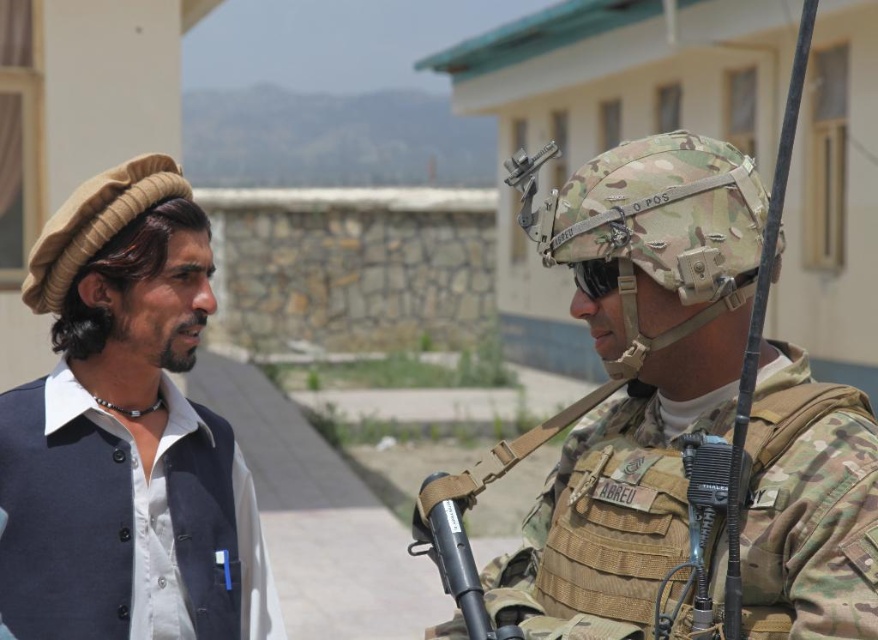
Question: Can you confirm if camouflage fabric helmet at center is positioned to the left of dark blue fabric shirt at left?

Choices:
 (A) no
 (B) yes

Answer: (A)

Question: Is camouflage fabric helmet at center further to camera compared to dark blue fabric shirt at left?

Choices:
 (A) yes
 (B) no

Answer: (B)

Question: Which point is closer to the camera taking this photo?

Choices:
 (A) (657, 148)
 (B) (246, 525)

Answer: (A)

Question: Which point appears farthest from the camera in this image?

Choices:
 (A) 193,353
 (B) 876,506

Answer: (A)

Question: Can you confirm if camouflage fabric helmet at center is positioned to the right of dark blue fabric shirt at left?

Choices:
 (A) yes
 (B) no

Answer: (A)

Question: Which of the following is the farthest from the observer?

Choices:
 (A) (239, 554)
 (B) (675, 378)

Answer: (A)